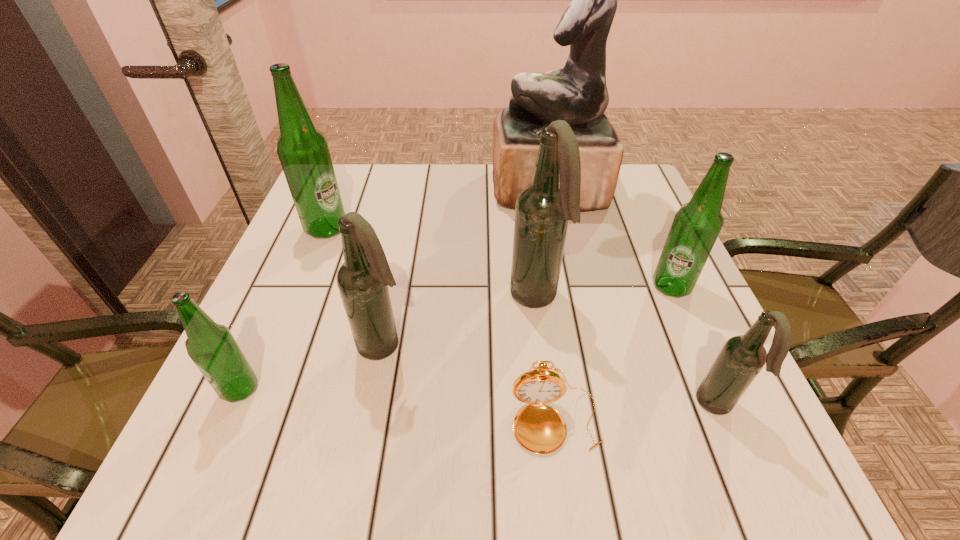
In order to click on free space at the far right corner of the desktop in this screenshot , I will do tap(633, 177).

Find the location of a particular element. free area in between the farthest dark beer bottle and the second smallest green beer bottle is located at coordinates (603, 292).

The width and height of the screenshot is (960, 540). Find the location of `blank region between the pocket watch and the third beer bottle from right to left`. blank region between the pocket watch and the third beer bottle from right to left is located at coordinates tap(545, 360).

Where is `vacant space in between the farthest green beer bottle and the smallest green beer bottle`? The width and height of the screenshot is (960, 540). vacant space in between the farthest green beer bottle and the smallest green beer bottle is located at coordinates pyautogui.click(x=283, y=308).

This screenshot has height=540, width=960. I want to click on vacant area that lies between the farthest beer bottle and the smallest green beer bottle, so click(283, 308).

Identify the location of blank region between the pocket watch and the nearest dark beer bottle. This screenshot has height=540, width=960. (636, 414).

The height and width of the screenshot is (540, 960). I want to click on free space between the biggest dark beer bottle and the second nearest green beer bottle, so click(x=603, y=292).

This screenshot has width=960, height=540. In order to click on free space between the rightmost dark beer bottle and the farthest dark beer bottle in this screenshot , I will do `click(625, 352)`.

Where is `free space between the tallest object and the smallest green beer bottle`? This screenshot has height=540, width=960. free space between the tallest object and the smallest green beer bottle is located at coordinates (395, 289).

Identify the location of the seventh closest object relative to the biggest green beer bottle. (742, 357).